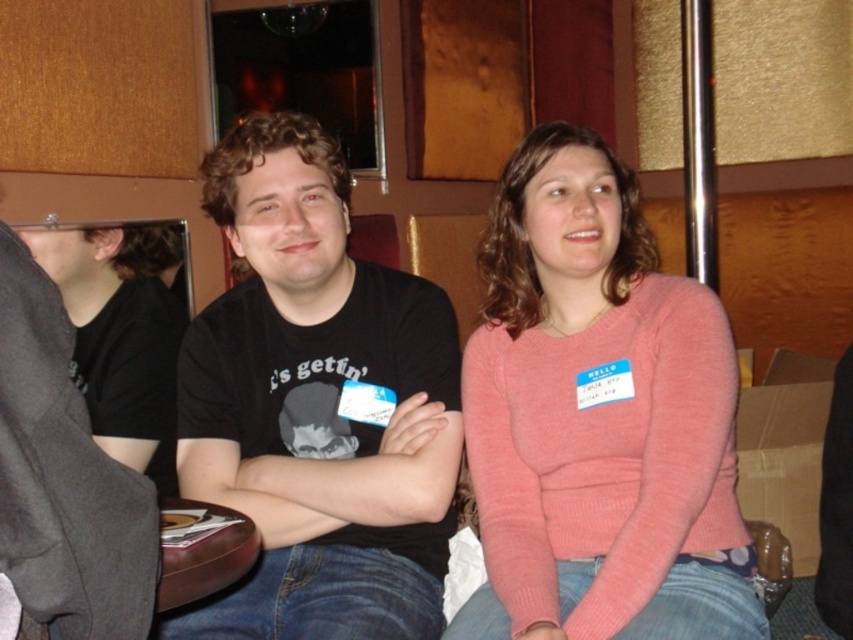
You are organizing a clothing donation drive and need to determine if the pink knitted sweater at center and the black matte shirt at left can fit side by side on a shelf that is 1.2 meters wide. Based on their widths, can both items fit together?

The pink knitted sweater at center might be wider than black matte shirt at left, so it is uncertain if both can fit on a 1.2 meter shelf without overlapping. Measure both items to confirm their exact widths before deciding.

You are organizing a photo shoot and need to place a small prop at the exact center of the image. However, you must avoid placing it over the pink knitted sweater at center. Where should you position the prop instead?

The pink knitted sweater at center is located at point (598, 419). To avoid placing the prop over it, position the prop slightly to the left or right of this coordinate, ensuring it remains centered but not overlapping the sweater.